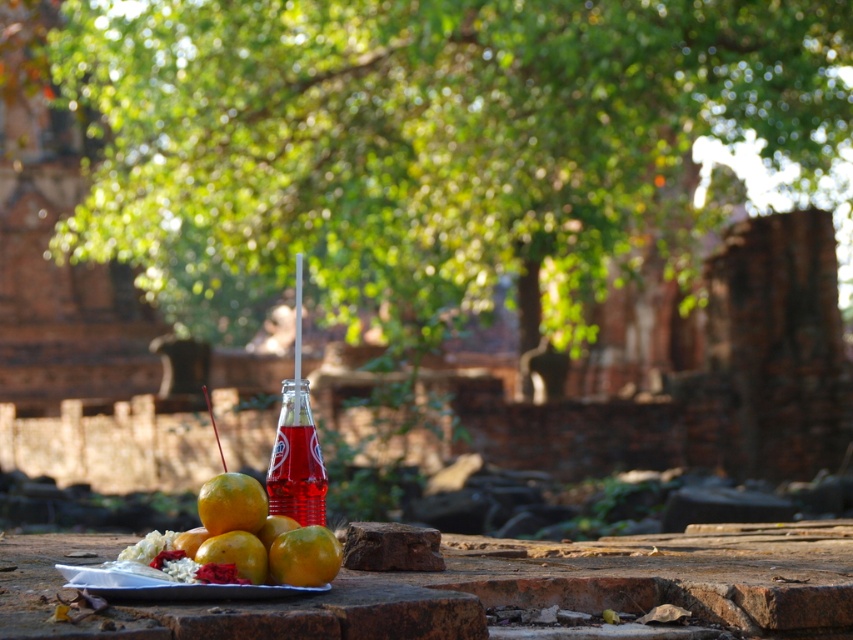
Question: Does green leafy tree at center have a larger size compared to translucent glass bottle at center?

Choices:
 (A) no
 (B) yes

Answer: (B)

Question: Does shiny metallic plate at center come behind shiny yellow orange at center?

Choices:
 (A) no
 (B) yes

Answer: (A)

Question: Which object is the closest to the translucent glass bottle at center?

Choices:
 (A) shiny yellow orange at center
 (B) glossy orange at center

Answer: (A)

Question: Can you confirm if shiny metallic plate at center is wider than translucent glass bottle at center?

Choices:
 (A) yes
 (B) no

Answer: (A)

Question: Which is farther from the glossy orange at center?

Choices:
 (A) translucent glass bottle at center
 (B) shiny yellow orange at center
 (C) green leafy tree at center
 (D) shiny metallic plate at center

Answer: (C)

Question: Considering the real-world distances, which object is farthest from the glossy orange at center?

Choices:
 (A) shiny yellow orange at center
 (B) green leafy tree at center
 (C) shiny metallic plate at center

Answer: (B)